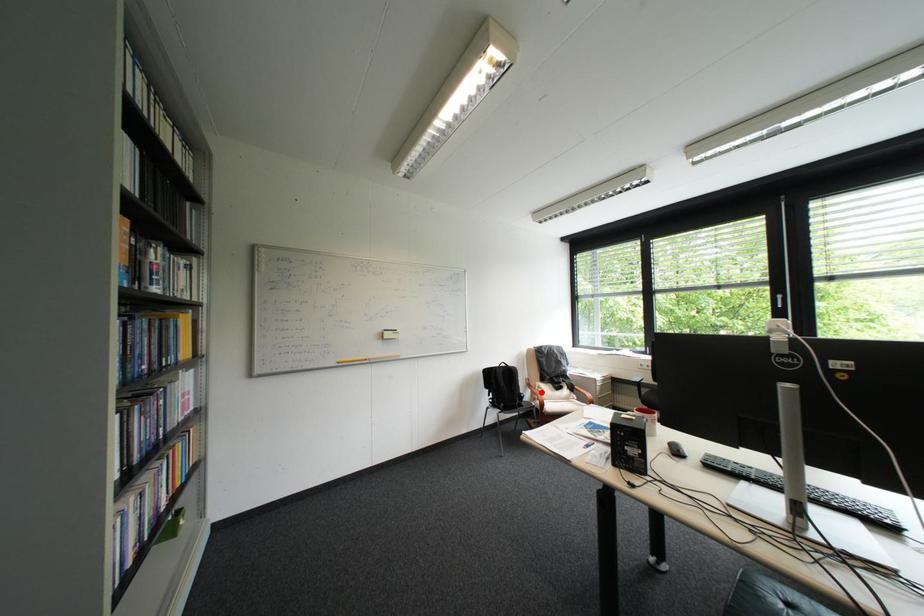
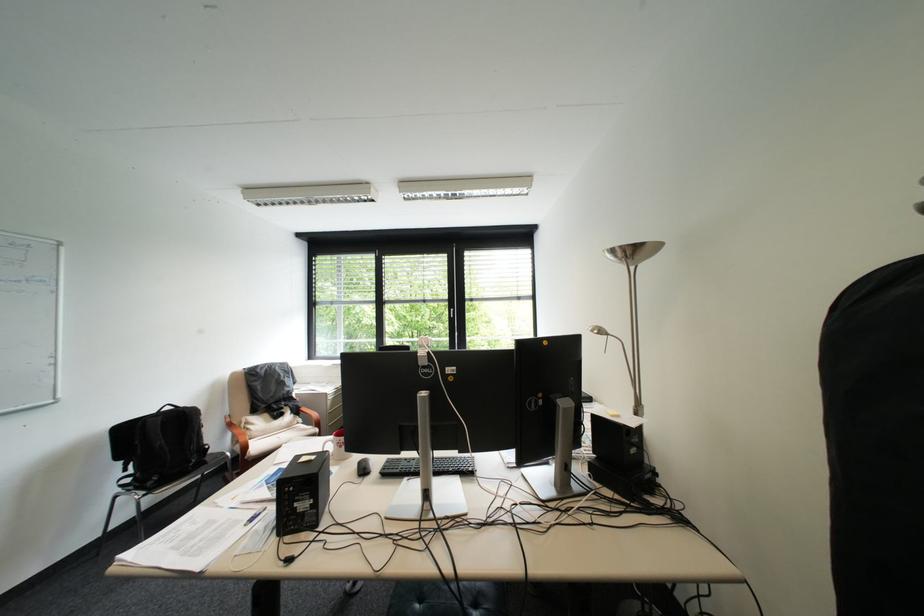
Question: A red point is marked in image1. In image2, is the corresponding 3D point closer to the camera or farther? Reply with the corresponding letter.

Choices:
 (A) The corresponding 3D point is closer.
 (B) The corresponding 3D point is farther.

Answer: (A)